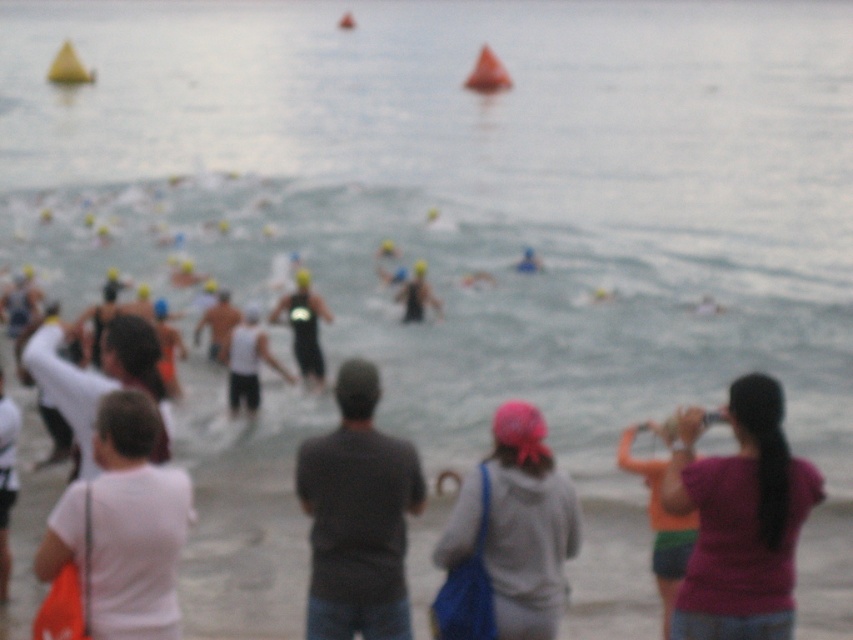
You are a photographer positioned at the beach during the triathlon. You need to capture a photo of both the gray fabric hoodie at center and the black matte wetsuit at center. Given their widths, which object should you frame first to ensure both fit in the shot?

The gray fabric hoodie at center is wider than the black matte wetsuit at center. To ensure both fit in the shot, frame the gray fabric hoodie at center first as it occupies more space, then adjust the camera angle to include the black matte wetsuit at center.

You are a photographer standing on the beach at a triathlon event. You need to capture a shot of both the white matte shirt at lower left and the black matte wetsuit at center. Based on their positions, which one is closer to the camera?

The white matte shirt at lower left is closer to the camera because it is not as tall as the black matte wetsuit at center, indicating it is positioned in front.

You are a photographer at the triathlon event and need to capture a clear shot of the black matte wetsuit at center without the gray fabric hoodie at center blocking the view. Can you adjust your position to achieve this?

The gray fabric hoodie at center has a larger size compared to the black matte wetsuit at center. Since the hoodie is larger, moving closer to the black matte wetsuit at center or adjusting your angle to avoid the hoodie might help capture the wetsuit without obstruction.